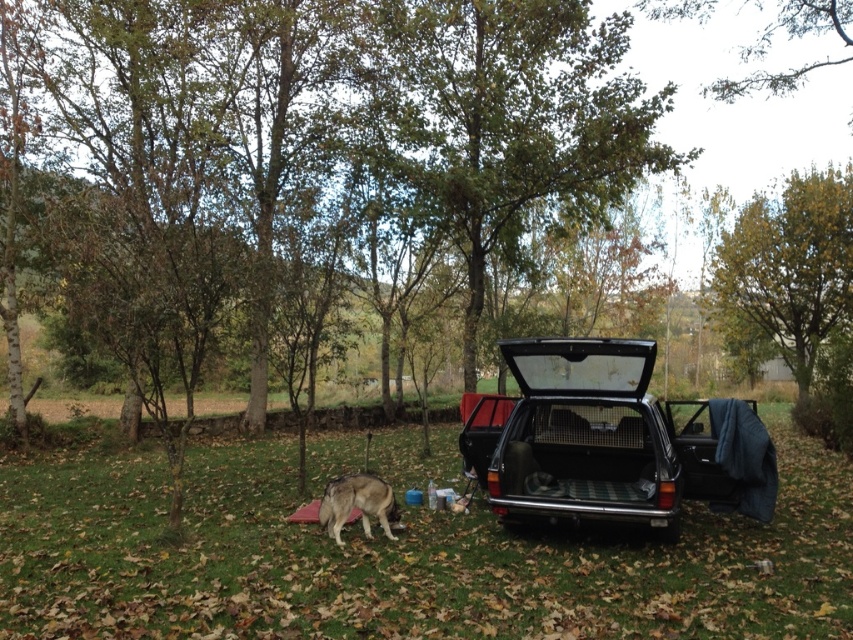
Question: Which point is farther to the camera?

Choices:
 (A) black matte car at right
 (B) fuzzy brown dog at lower left

Answer: (B)

Question: Is black matte car at right smaller than fuzzy brown dog at lower left?

Choices:
 (A) no
 (B) yes

Answer: (A)

Question: Among these points, which one is nearest to the camera?

Choices:
 (A) (376, 502)
 (B) (624, 422)

Answer: (A)

Question: Can you confirm if black matte car at right is bigger than fuzzy brown dog at lower left?

Choices:
 (A) no
 (B) yes

Answer: (B)

Question: Does black matte car at right lie in front of fuzzy brown dog at lower left?

Choices:
 (A) yes
 (B) no

Answer: (A)